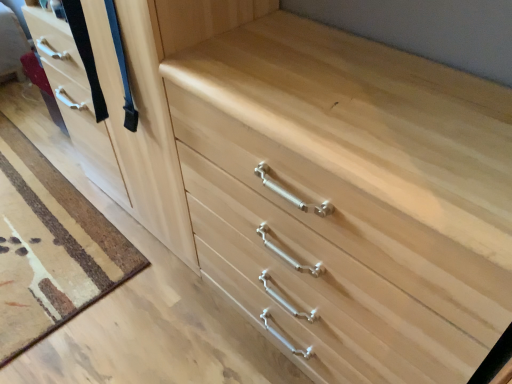
In order to click on natural wood drawer at center in this screenshot , I will do `click(316, 291)`.

What do you see at coordinates (316, 291) in the screenshot? The image size is (512, 384). I see `natural wood drawer at center` at bounding box center [316, 291].

Identify the location of matte wood door at left. This screenshot has height=384, width=512. (123, 119).

What do you see at coordinates (123, 119) in the screenshot? This screenshot has height=384, width=512. I see `matte wood door at left` at bounding box center [123, 119].

This screenshot has width=512, height=384. I want to click on natural wood drawer at center, so click(316, 291).

Between matte wood door at left and natural wood drawer at center, which one appears on the right side from the viewer's perspective?

From the viewer's perspective, natural wood drawer at center appears more on the right side.

Is matte wood door at left in front of or behind natural wood drawer at center in the image?

Clearly, matte wood door at left is behind natural wood drawer at center.

Which is further, (108, 93) or (179, 150)?

The point (108, 93) is behind.

From the picture: From the image's perspective, between matte wood door at left and natural wood drawer at center, who is located below?

From the image's view, natural wood drawer at center is below.

Based on the photo, from a real-world perspective, does matte wood door at left sit lower than natural wood drawer at center?

No.

In terms of width, does matte wood door at left look wider or thinner when compared to natural wood drawer at center?

matte wood door at left is thinner than natural wood drawer at center.

Considering the relative sizes of matte wood door at left and natural wood drawer at center in the image provided, is matte wood door at left taller than natural wood drawer at center?

Correct, matte wood door at left is much taller as natural wood drawer at center.

Which of these two, matte wood door at left or natural wood drawer at center, is bigger?

matte wood door at left.

Looking at this image, do you think matte wood door at left is within natural wood drawer at center, or outside of it?

matte wood door at left is not inside natural wood drawer at center, it's outside.

Would you say matte wood door at left is a long distance from natural wood drawer at center?

They are positioned close to each other.

Is matte wood door at left oriented away from natural wood drawer at center?

matte wood door at left does not have its back to natural wood drawer at center.

Measure the distance from matte wood door at left to natural wood drawer at center.

They are 15.62 inches apart.

At what (x,y) coordinates should I click in order to perform the action: click on door behind the natural wood drawer at center. Please return your answer as a coordinate pair (x, y). This screenshot has height=384, width=512. Looking at the image, I should click on (123, 119).

Can you confirm if natural wood drawer at center is positioned to the right of matte wood door at left?

Indeed, natural wood drawer at center is positioned on the right side of matte wood door at left.

In the scene shown: Does natural wood drawer at center lie behind matte wood door at left?

No, natural wood drawer at center is closer to the viewer.

Does point (192, 197) come closer to viewer compared to point (105, 81)?

Yes, point (192, 197) is in front of point (105, 81).

From the image's perspective, does natural wood drawer at center appear lower than matte wood door at left?

Yes, from the image's perspective, natural wood drawer at center is below matte wood door at left.

From a real-world perspective, is natural wood drawer at center over matte wood door at left?

Incorrect, from a real-world perspective, natural wood drawer at center is lower than matte wood door at left.

Is natural wood drawer at center wider than matte wood door at left?

Yes.

Considering the sizes of natural wood drawer at center and matte wood door at left in the image, is natural wood drawer at center taller or shorter than matte wood door at left?

In the image, natural wood drawer at center appears to be shorter than matte wood door at left.

Between natural wood drawer at center and matte wood door at left, which one has smaller size?

natural wood drawer at center.

Which is correct: natural wood drawer at center is inside matte wood door at left, or outside of it?

natural wood drawer at center is located beyond the bounds of matte wood door at left.

Is natural wood drawer at center far away from matte wood door at left?

Actually, natural wood drawer at center and matte wood door at left are a little close together.

Based on the photo, is natural wood drawer at center turned away from matte wood door at left?

No, natural wood drawer at center is not facing away from matte wood door at left.

Locate an element on the screen. This screenshot has height=384, width=512. drawer lying in front of the matte wood door at left is located at coordinates (316, 291).

Identify the location of drawer below the matte wood door at left (from a real-world perspective). (316, 291).

In the image, there is a matte wood door at left. Where is `drawer below it (from the image's perspective)`? drawer below it (from the image's perspective) is located at coordinates tap(316, 291).